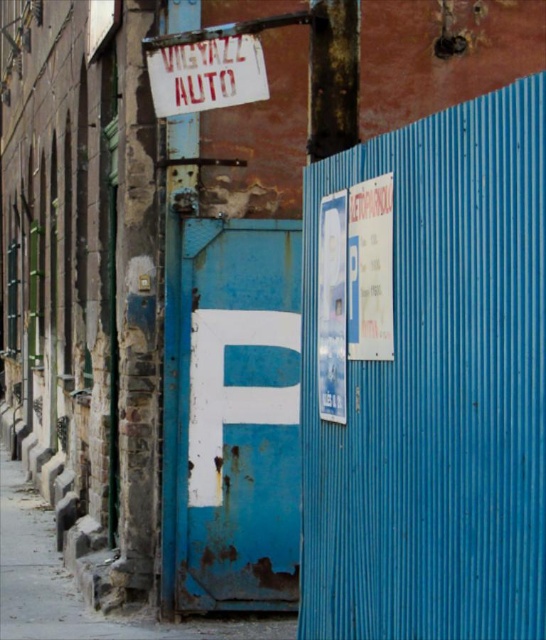
You are a painter standing in front of the building and want to touch up the rusty metal letter at center and the rusty metal sign at upper center. Which object should you reach for first without moving your position?

The rusty metal letter at center is closer to you than the rusty metal sign at upper center, so you should reach for the rusty metal letter at center first.